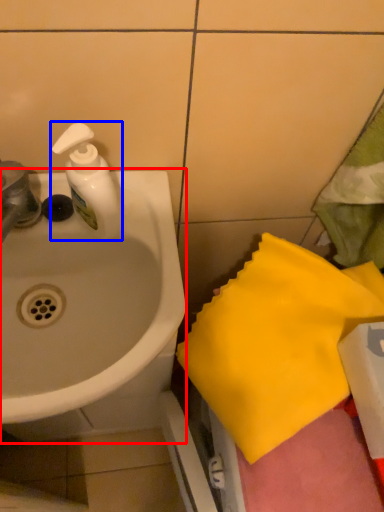
Question: Among these objects, which one is farthest to the camera, sink (highlighted by a red box) or soap dispenser (highlighted by a blue box)?

Choices:
 (A) sink
 (B) soap dispenser

Answer: (B)